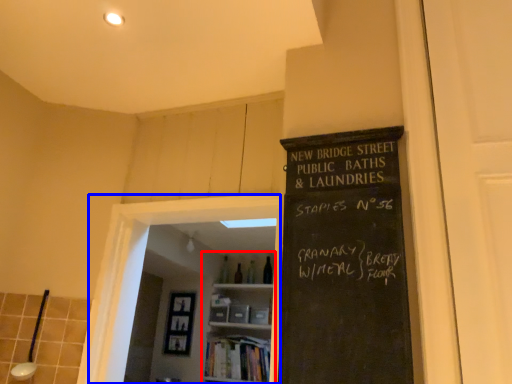
Question: Which point is closer to the camera, bookshelf (highlighted by a red box) or glass door (highlighted by a blue box)?

Choices:
 (A) bookshelf
 (B) glass door

Answer: (B)